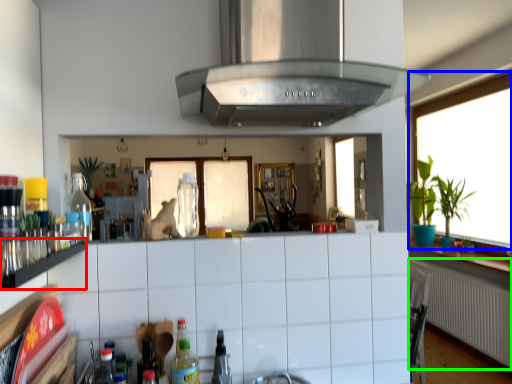
Question: Estimate the real-world distances between objects in this image. Which object is closer to shelf (highlighted by a red box), window (highlighted by a blue box) or radiator (highlighted by a green box)?

Choices:
 (A) window
 (B) radiator

Answer: (B)